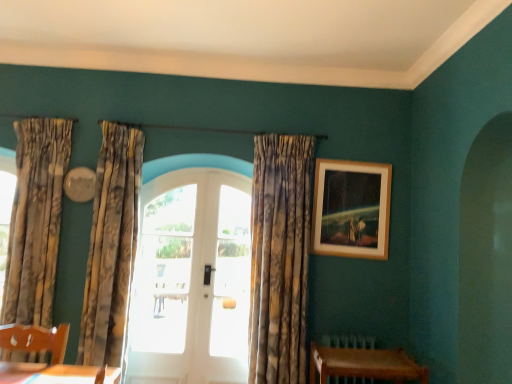
Question: Is point (196, 331) positioned closer to the camera than point (370, 367)?

Choices:
 (A) closer
 (B) farther

Answer: (B)

Question: From the image's perspective, is white glossy door at center above or below wooden table at lower right?

Choices:
 (A) above
 (B) below

Answer: (A)

Question: Which is farther from the textured beige curtains at left, the 2th curtain from the right?

Choices:
 (A) brown wooden radiator at lower right
 (B) wooden table at lower right
 (C) white glass door at center, the 1th window when ordered from left to right
 (D) patterned fabric curtain at left, which ranks as the first curtain in left-to-right order
 (E) textured gold curtain at center, the third curtain from the left

Answer: (A)

Question: Which is nearer to the wooden table at lower right?

Choices:
 (A) textured beige curtains at left, which ranks as the second curtain in left-to-right order
 (B) patterned fabric curtain at left, the third curtain in the right-to-left sequence
 (C) white glass door at center, which is the first window from right to left
 (D) wooden frame at upper right
 (E) white glossy door at center

Answer: (D)